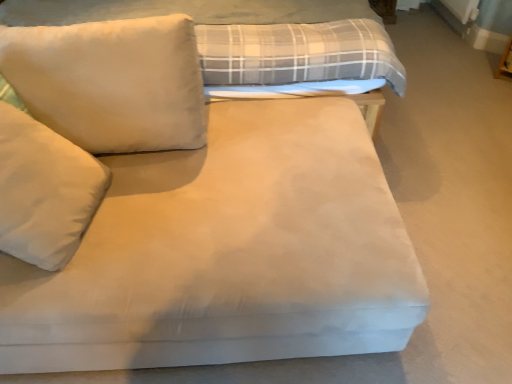
Question: Is the surface of white soft pillow at left, the 2th pillow when ordered from top to bottom, in direct contact with white soft pillow at upper left, placed as the 2th pillow when sorted from bottom to top?

Choices:
 (A) yes
 (B) no

Answer: (B)

Question: Considering the relative sizes of white soft pillow at left, the 2th pillow when ordered from top to bottom, and white soft pillow at upper left, marked as the first pillow in a top-to-bottom arrangement, in the image provided, is white soft pillow at left, the 2th pillow when ordered from top to bottom, smaller than white soft pillow at upper left, marked as the first pillow in a top-to-bottom arrangement,?

Choices:
 (A) yes
 (B) no

Answer: (A)

Question: Considering the relative positions of white soft pillow at left, the first pillow ordered from the bottom, and white soft pillow at upper left, marked as the first pillow in a top-to-bottom arrangement, in the image provided, is white soft pillow at left, the first pillow ordered from the bottom, to the left of white soft pillow at upper left, marked as the first pillow in a top-to-bottom arrangement, from the viewer's perspective?

Choices:
 (A) no
 (B) yes

Answer: (B)

Question: Is white soft pillow at left, the 2th pillow when ordered from top to bottom, outside white soft pillow at upper left, placed as the 2th pillow when sorted from bottom to top?

Choices:
 (A) no
 (B) yes

Answer: (B)

Question: From the image's perspective, would you say white soft pillow at left, the 2th pillow when ordered from top to bottom, is positioned over white soft pillow at upper left, placed as the 2th pillow when sorted from bottom to top?

Choices:
 (A) yes
 (B) no

Answer: (B)

Question: Would you say white soft pillow at upper left, placed as the 2th pillow when sorted from bottom to top, is part of white soft pillow at left, the 2th pillow when ordered from top to bottom,'s contents?

Choices:
 (A) yes
 (B) no

Answer: (B)

Question: From a real-world perspective, does suede-like beige bed at center sit lower than white soft pillow at upper left, placed as the 2th pillow when sorted from bottom to top?

Choices:
 (A) yes
 (B) no

Answer: (A)

Question: Considering the relative positions of suede-like beige bed at center and white soft pillow at upper left, marked as the first pillow in a top-to-bottom arrangement, in the image provided, is suede-like beige bed at center to the right of white soft pillow at upper left, marked as the first pillow in a top-to-bottom arrangement, from the viewer's perspective?

Choices:
 (A) no
 (B) yes

Answer: (B)

Question: Is there a large distance between suede-like beige bed at center and white soft pillow at upper left, placed as the 2th pillow when sorted from bottom to top?

Choices:
 (A) yes
 (B) no

Answer: (B)

Question: Considering the relative sizes of suede-like beige bed at center and white soft pillow at upper left, marked as the first pillow in a top-to-bottom arrangement, in the image provided, is suede-like beige bed at center smaller than white soft pillow at upper left, marked as the first pillow in a top-to-bottom arrangement,?

Choices:
 (A) yes
 (B) no

Answer: (B)

Question: Does suede-like beige bed at center lie behind white soft pillow at upper left, placed as the 2th pillow when sorted from bottom to top?

Choices:
 (A) yes
 (B) no

Answer: (A)

Question: Considering the relative positions of suede-like beige bed at center and white soft pillow at upper left, marked as the first pillow in a top-to-bottom arrangement, in the image provided, is suede-like beige bed at center in front of white soft pillow at upper left, marked as the first pillow in a top-to-bottom arrangement,?

Choices:
 (A) no
 (B) yes

Answer: (A)

Question: Can you confirm if white soft pillow at left, the 2th pillow when ordered from top to bottom, is bigger than suede-like beige bed at center?

Choices:
 (A) yes
 (B) no

Answer: (B)